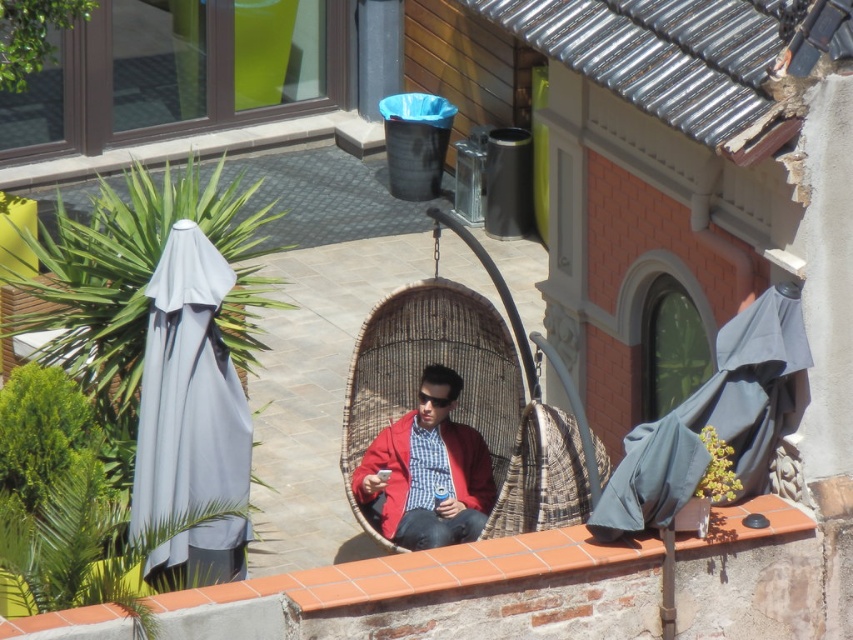
Question: Is gray fabric umbrella at left positioned before matte red jacket at center?

Choices:
 (A) no
 (B) yes

Answer: (B)

Question: Which of these objects is positioned closest to the woven rattan chair at center?

Choices:
 (A) gray fabric umbrella at left
 (B) dark gray fabric umbrella at right
 (C) terracotta brick ledge at lower center
 (D) matte red jacket at center

Answer: (D)

Question: Which of the following is the closest to the observer?

Choices:
 (A) (157, 410)
 (B) (782, 525)
 (C) (422, 486)
 (D) (778, 337)

Answer: (A)

Question: Which is nearer to the dark gray fabric umbrella at right?

Choices:
 (A) woven rattan chair at center
 (B) matte red jacket at center
 (C) terracotta brick ledge at lower center

Answer: (C)

Question: Does woven rattan chair at center appear on the left side of matte red jacket at center?

Choices:
 (A) yes
 (B) no

Answer: (B)

Question: Considering the relative positions of dark gray fabric umbrella at right and matte red jacket at center in the image provided, where is dark gray fabric umbrella at right located with respect to matte red jacket at center?

Choices:
 (A) right
 (B) left

Answer: (A)